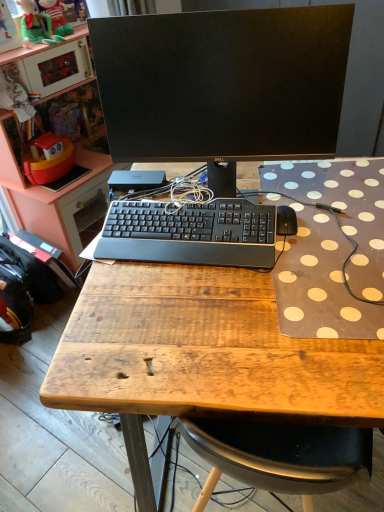
Question: Is black matte mouse at right in front of or behind black fabric backpack at lower left, acting as the second backpack starting from the front, in the image?

Choices:
 (A) behind
 (B) front

Answer: (B)

Question: From the image's perspective, is black matte mouse at right located above or below black fabric backpack at lower left, which is counted as the 1th backpack, starting from the back?

Choices:
 (A) above
 (B) below

Answer: (A)

Question: Which is nearer to the black matte mouse at right?

Choices:
 (A) green plush toy at upper left, which is the first toy from bottom to top
 (B) wooden desk at center
 (C) black leather backpack at lower left, which is the second backpack in back-to-front order
 (D) velvet green plush at upper left, the first toy in the top-to-bottom sequence
 (E) matte pink cabinet at upper left

Answer: (B)

Question: Which of these objects is positioned closest to the wooden desk at center?

Choices:
 (A) black matte monitor at center
 (B) black leather backpack at lower left, which is the second backpack in back-to-front order
 (C) green plush toy at upper left, marked as the second toy in a top-to-bottom arrangement
 (D) black matte mouse at right
 (E) matte pink cabinet at upper left

Answer: (D)